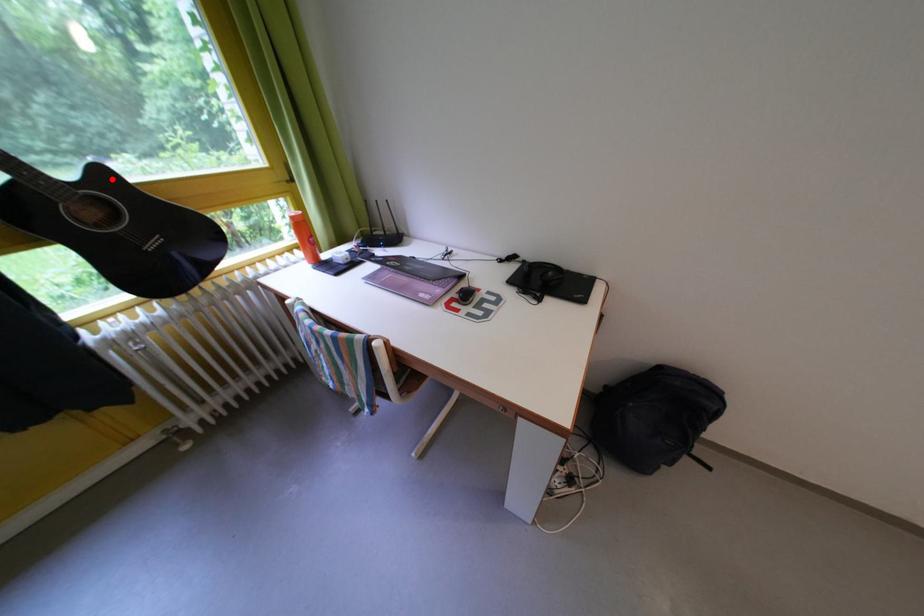
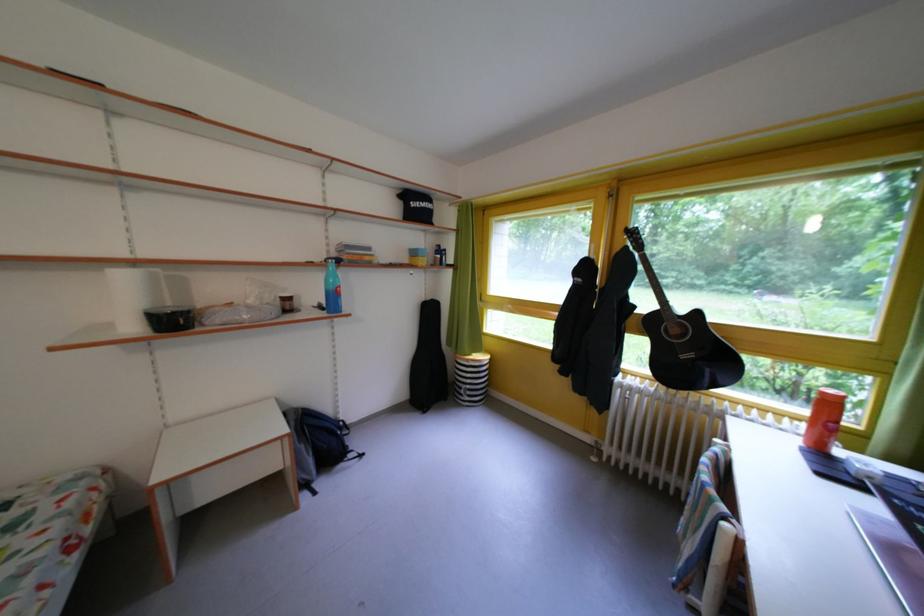
Find the pixel in the second image that matches the highlighted location in the first image.

(707, 320)